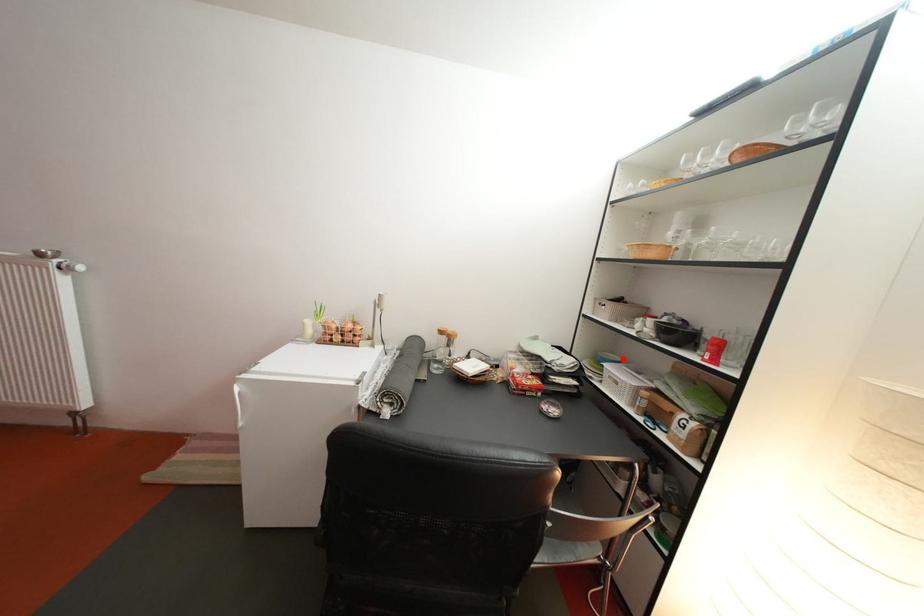
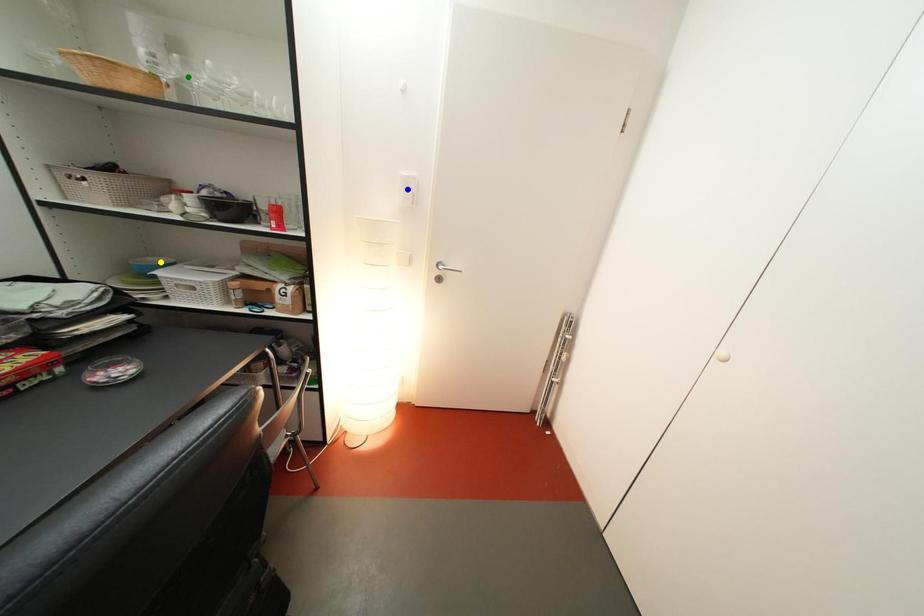
Question: I am providing you with two images of the same scene from different viewpoints. A red point is marked on the first image. You are given multiple points on the second image. Which point in image 2 represents the same 3d spot as the red point in image 1?

Choices:
 (A) yellow point
 (B) blue point
 (C) green point

Answer: (A)